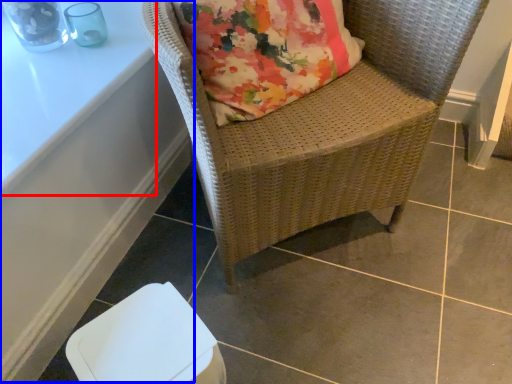
Question: Among these objects, which one is farthest to the camera, table (highlighted by a red box) or table (highlighted by a blue box)?

Choices:
 (A) table
 (B) table

Answer: (B)